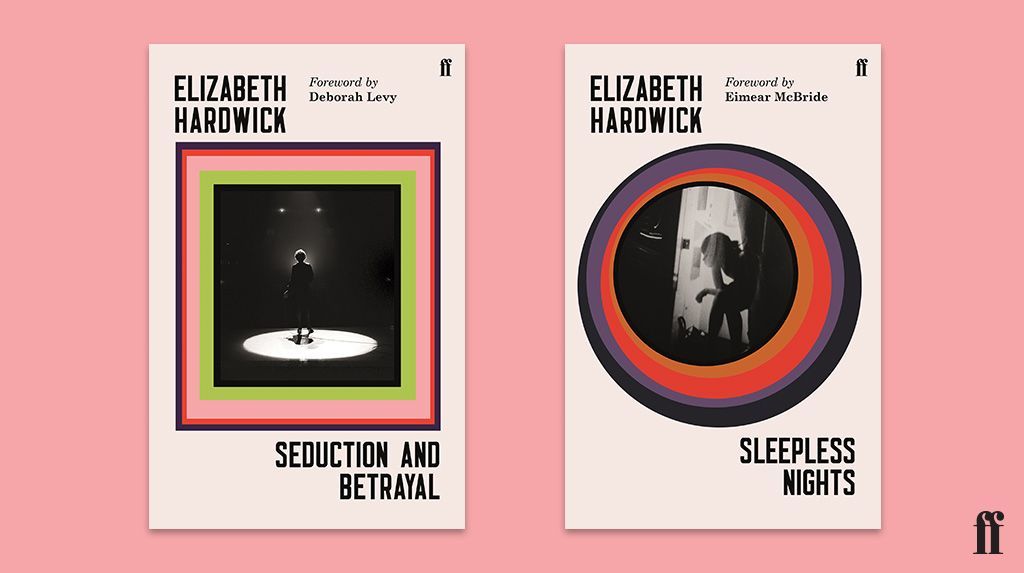
At what (x,y) coordinates should I click in order to perform the action: click on stage spotlight. Please return your answer as a coordinate pair (x, y). This screenshot has width=1024, height=573. Looking at the image, I should click on (329, 347).